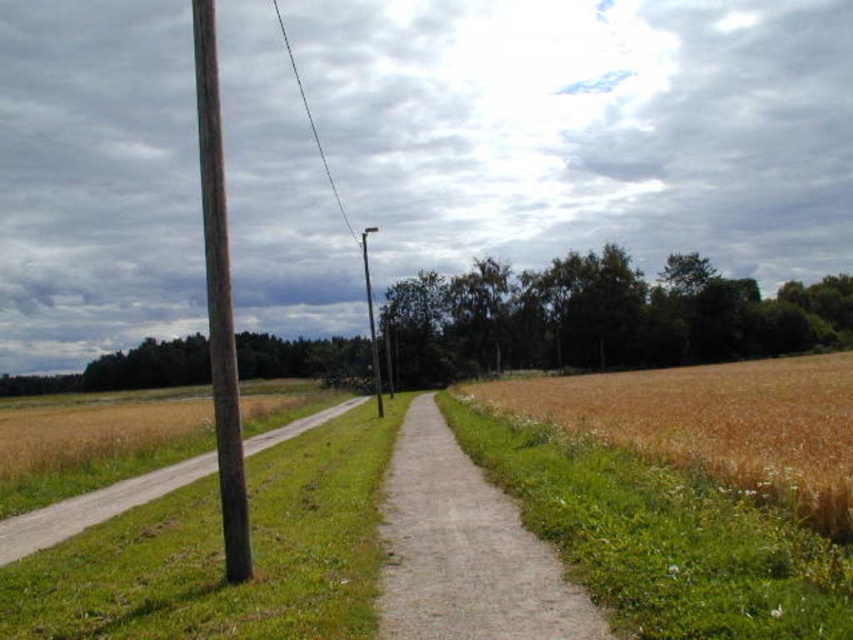
Is brown grassy wheat field at right positioned in front of metallic gray pole at center?

Yes.

Is brown grassy wheat field at right above metallic gray pole at center?

Incorrect, brown grassy wheat field at right is not positioned above metallic gray pole at center.

Is point (659, 388) positioned behind point (364, 260)?

No, it is not.

In order to click on brown grassy wheat field at right in this screenshot , I will do `click(715, 422)`.

Based on the photo, can you confirm if brown grassy wheat field at right is thinner than gray gravel path at center?

No.

Which is more to the right, brown grassy wheat field at right or gray gravel path at center?

From the viewer's perspective, brown grassy wheat field at right appears more on the right side.

Image resolution: width=853 pixels, height=640 pixels. What do you see at coordinates (715, 422) in the screenshot?
I see `brown grassy wheat field at right` at bounding box center [715, 422].

Image resolution: width=853 pixels, height=640 pixels. What are the coordinates of `brown grassy wheat field at right` in the screenshot? It's located at (715, 422).

Is point (210, 250) positioned before point (306, 120)?

Yes, point (210, 250) is in front of point (306, 120).

Can you confirm if brown wooden pole at left is thinner than black wire at upper center?

Correct, brown wooden pole at left's width is less than black wire at upper center's.

Is point (224, 212) less distant than point (346, 216)?

Yes, it is in front of point (346, 216).

Locate an element on the screen. brown wooden pole at left is located at coordinates (219, 300).